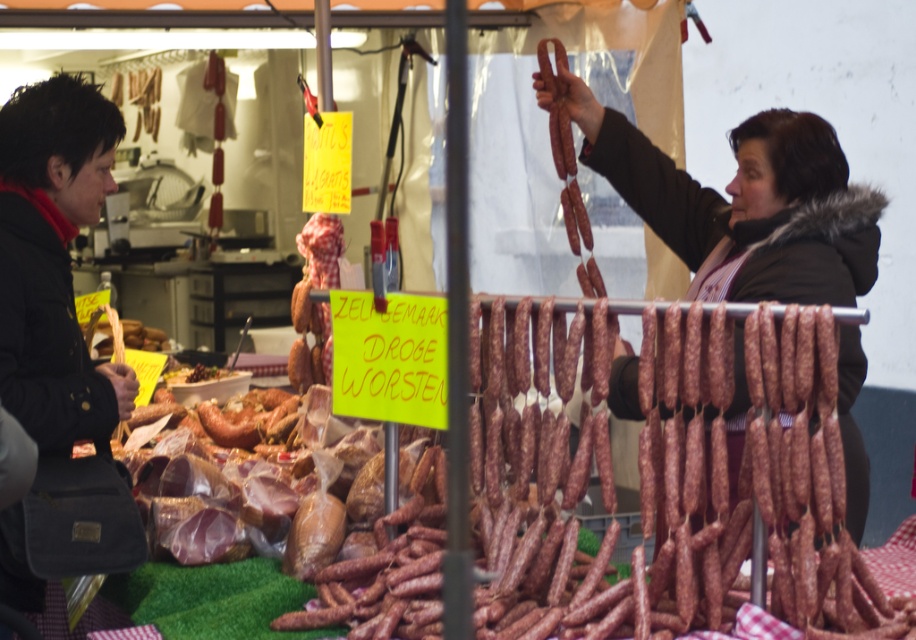
Question: Among these objects, which one is nearest to the camera?

Choices:
 (A) black fabric bag at left
 (B) shiny brown meat at center

Answer: (A)

Question: Which object is closer to the camera taking this photo?

Choices:
 (A) shiny brown meat at center
 (B) black fabric bag at left

Answer: (B)

Question: Can you confirm if black fabric bag at left is smaller than shiny brown meat at center?

Choices:
 (A) yes
 (B) no

Answer: (B)

Question: Can you confirm if black fabric bag at left is positioned below shiny brown meat at center?

Choices:
 (A) yes
 (B) no

Answer: (B)

Question: Which point is farther to the camera?

Choices:
 (A) (195, 378)
 (B) (41, 374)

Answer: (A)

Question: Does black fabric bag at left have a smaller size compared to shiny brown meat at center?

Choices:
 (A) yes
 (B) no

Answer: (B)